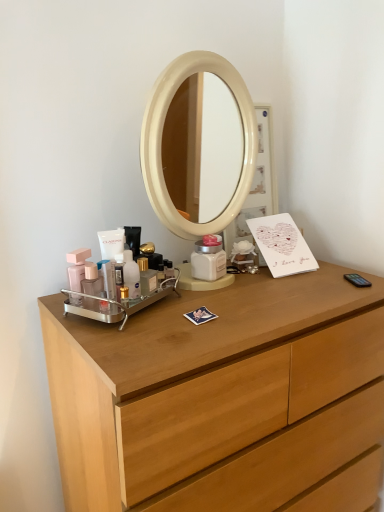
Question: Is translucent plastic bottle at center, the 1th toiletry when ordered from right to left, not inside matte pink bottle at left, the second toiletry from the left?

Choices:
 (A) yes
 (B) no

Answer: (A)

Question: From the image's perspective, does translucent plastic bottle at center, placed as the fourth toiletry when sorted from left to right, appear lower than matte pink bottle at left, the second toiletry from the left?

Choices:
 (A) no
 (B) yes

Answer: (A)

Question: Can you confirm if translucent plastic bottle at center, placed as the fourth toiletry when sorted from left to right, is wider than matte pink bottle at left, the 3th toiletry in the right-to-left sequence?

Choices:
 (A) no
 (B) yes

Answer: (B)

Question: Does translucent plastic bottle at center, placed as the fourth toiletry when sorted from left to right, have a lesser height compared to matte pink bottle at left, the 3th toiletry in the right-to-left sequence?

Choices:
 (A) yes
 (B) no

Answer: (A)

Question: From a real-world perspective, is translucent plastic bottle at center, the 1th toiletry when ordered from right to left, physically above matte pink bottle at left, the 3th toiletry in the right-to-left sequence?

Choices:
 (A) yes
 (B) no

Answer: (A)

Question: Does point (122, 268) appear closer or farther from the camera than point (72, 279)?

Choices:
 (A) closer
 (B) farther

Answer: (A)

Question: Relative to matte pink plastic at left, marked as the fourth toiletry in a right-to-left arrangement, is translucent plastic tube at center, which is counted as the third toiletry, starting from the left, in front or behind?

Choices:
 (A) behind
 (B) front

Answer: (B)

Question: Is translucent plastic tube at center, the second toiletry viewed from the right, bigger or smaller than matte pink plastic at left, arranged as the first toiletry when viewed from the left?

Choices:
 (A) small
 (B) big

Answer: (A)

Question: Is translucent plastic tube at center, which is counted as the third toiletry, starting from the left, inside or outside of matte pink plastic at left, arranged as the first toiletry when viewed from the left?

Choices:
 (A) outside
 (B) inside

Answer: (A)

Question: From the image's perspective, is matte pink plastic at left, arranged as the first toiletry when viewed from the left, located above or below matte pink bottle at left, the 3th toiletry in the right-to-left sequence?

Choices:
 (A) above
 (B) below

Answer: (A)

Question: Considering the relative positions of matte pink plastic at left, marked as the fourth toiletry in a right-to-left arrangement, and matte pink bottle at left, the second toiletry from the left, in the image provided, is matte pink plastic at left, marked as the fourth toiletry in a right-to-left arrangement, to the left or to the right of matte pink bottle at left, the second toiletry from the left,?

Choices:
 (A) left
 (B) right

Answer: (A)

Question: From a real-world perspective, is matte pink plastic at left, marked as the fourth toiletry in a right-to-left arrangement, above or below matte pink bottle at left, the second toiletry from the left?

Choices:
 (A) above
 (B) below

Answer: (A)

Question: Looking at their shapes, would you say matte pink plastic at left, arranged as the first toiletry when viewed from the left, is wider or thinner than matte pink bottle at left, the second toiletry from the left?

Choices:
 (A) wide
 (B) thin

Answer: (A)

Question: From a real-world perspective, relative to translucent plastic bottle at center, placed as the fourth toiletry when sorted from left to right, is light wood chest of drawers at center vertically above or below?

Choices:
 (A) above
 (B) below

Answer: (B)

Question: Does point (107, 392) appear closer or farther from the camera than point (130, 251)?

Choices:
 (A) closer
 (B) farther

Answer: (A)